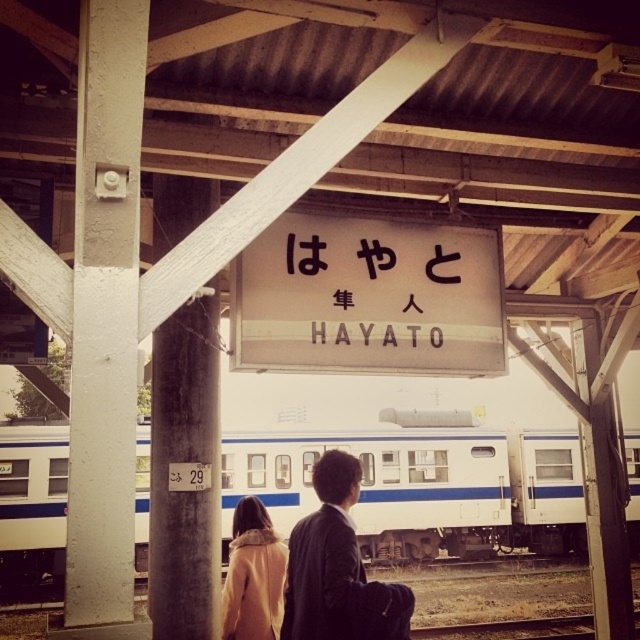
Question: Considering the relative positions of white painted wood at left and dark gray suit at center in the image provided, where is white painted wood at left located with respect to dark gray suit at center?

Choices:
 (A) below
 (B) above

Answer: (B)

Question: Can you confirm if dark gray suit at center is smaller than blackmaterial/texturesign at center?

Choices:
 (A) no
 (B) yes

Answer: (A)

Question: Which is farther from the white glossy train at center?

Choices:
 (A) white matte sign at center
 (B) white painted wood at left
 (C) blackmaterial/texturesign at center
 (D) dark gray suit at center

Answer: (B)

Question: Which of the following is the farthest from the observer?

Choices:
 (A) (403, 292)
 (B) (410, 300)
 (C) (348, 516)

Answer: (A)

Question: Is the position of white glossy train at center less distant than that of white matte sign at center?

Choices:
 (A) no
 (B) yes

Answer: (A)

Question: Considering the real-world distances, which object is closest to the dark gray suit at center?

Choices:
 (A) white glossy train at center
 (B) light brown fur coat at center
 (C) white painted wood at left

Answer: (B)